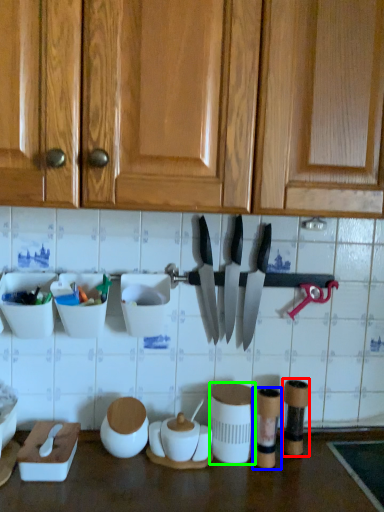
Question: Which object is positioned farthest from tableware (highlighted by a red box)? Select from tableware (highlighted by a blue box) and tableware (highlighted by a green box).

Choices:
 (A) tableware
 (B) tableware

Answer: (B)